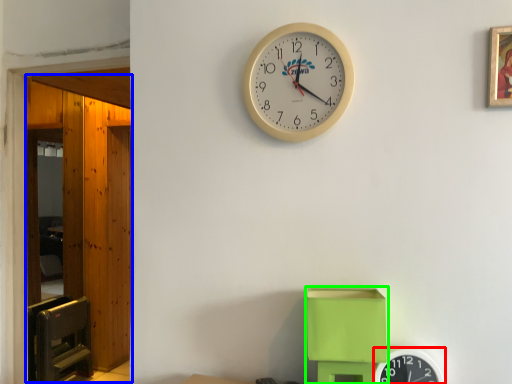
Question: Which object is the farthest from wall clock (highlighted by a red box)? Choose among these: glass door (highlighted by a blue box) or toy (highlighted by a green box).

Choices:
 (A) glass door
 (B) toy

Answer: (A)